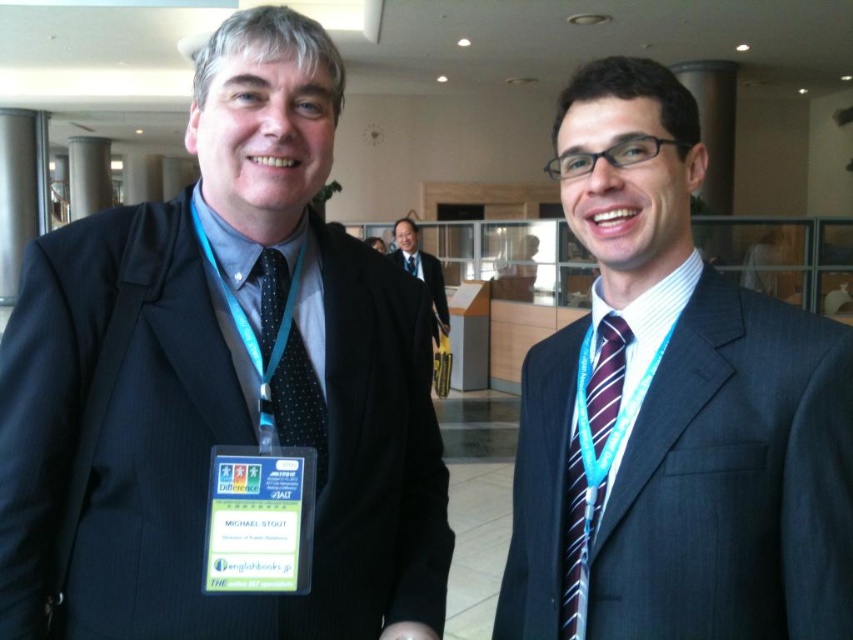
Does matte black suit at left have a larger size compared to black pinstripe suit at center?

No.

Which of these two, matte black suit at left or black pinstripe suit at center, stands shorter?

black pinstripe suit at center

Who is more forward, (41, 412) or (434, 323)?

Point (41, 412)

Where is `matte black suit at left`? The height and width of the screenshot is (640, 853). matte black suit at left is located at coordinates (223, 392).

The width and height of the screenshot is (853, 640). What do you see at coordinates (672, 412) in the screenshot? I see `dark blue suit at center` at bounding box center [672, 412].

Which is more to the right, dark blue suit at center or black dotted tie at left?

dark blue suit at center is more to the right.

Does point (749, 390) come farther from viewer compared to point (323, 444)?

That is False.

At what (x,y) coordinates should I click in order to perform the action: click on dark blue suit at center. Please return your answer as a coordinate pair (x, y). Image resolution: width=853 pixels, height=640 pixels. Looking at the image, I should click on (672, 412).

Can you confirm if black pinstripe suit at center is positioned to the left of black dotted tie at center?

In fact, black pinstripe suit at center is to the right of black dotted tie at center.

Is point (445, 301) more distant than point (409, 264)?

No, (445, 301) is closer to viewer.

This screenshot has height=640, width=853. Find the location of `black pinstripe suit at center`. black pinstripe suit at center is located at coordinates (428, 285).